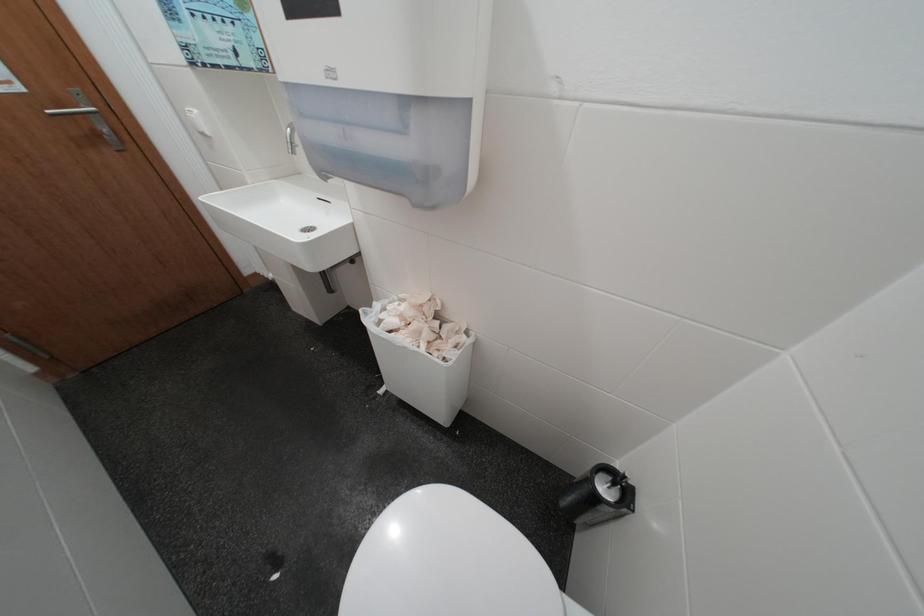
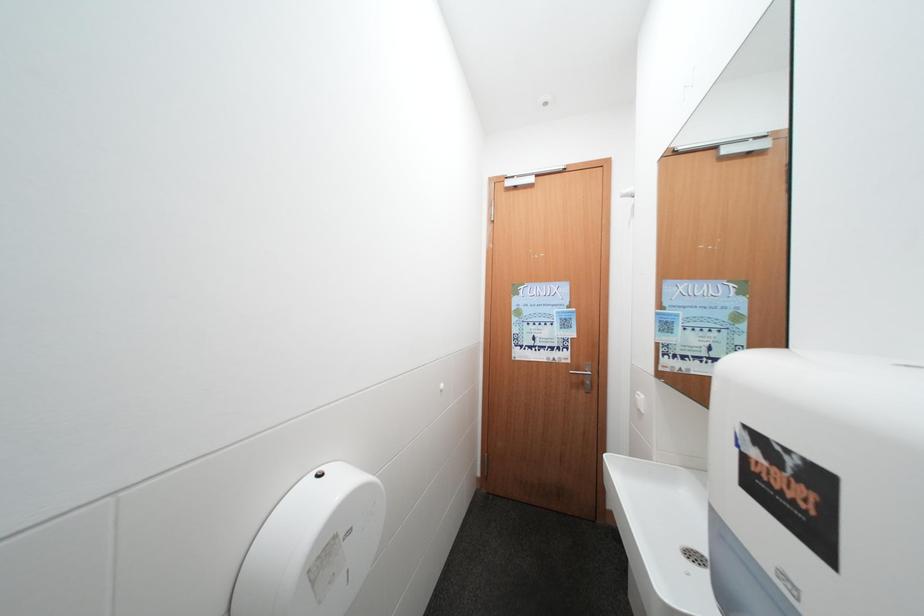
Question: Based on the continuous images, in which direction is the camera rotating? Reply with the corresponding letter.

Choices:
 (A) Left
 (B) Right
 (C) Up
 (D) Down

Answer: (A)